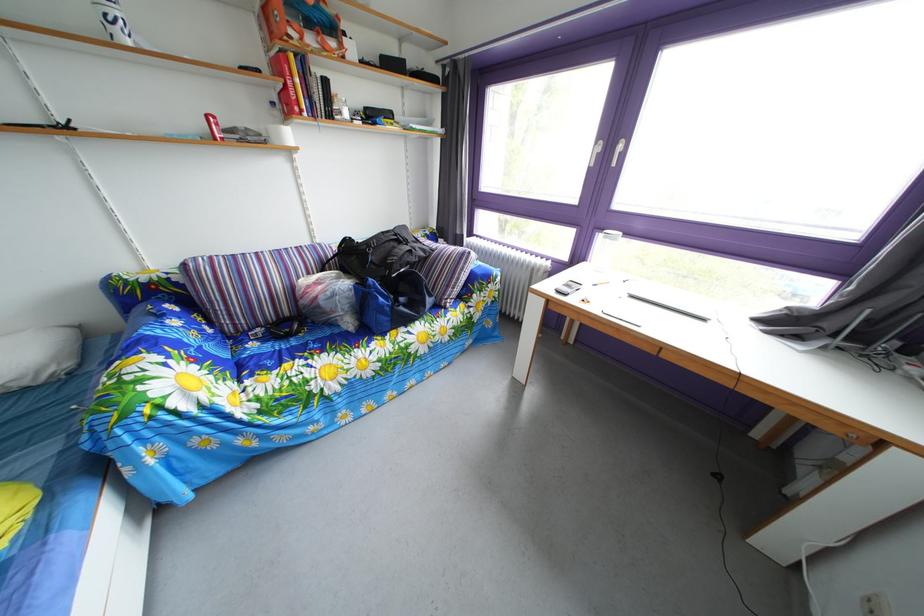
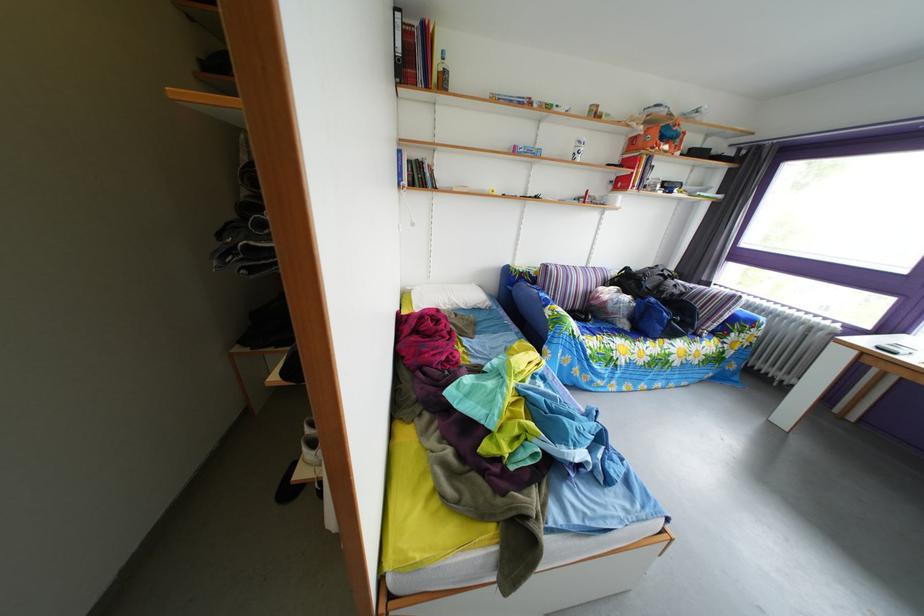
In the second image, find the point that corresponds to the point at 323,246 in the first image.

(599, 270)